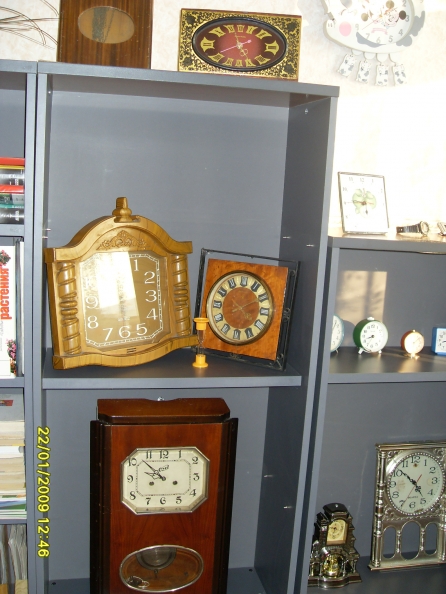
At what (x,y) coordinates should I click in order to perform the action: click on front edge of shelves. Please return your answer as a coordinate pair (x, y). The image size is (446, 594). Looking at the image, I should click on (172, 385), (356, 378), (15, 381), (9, 522), (9, 230).